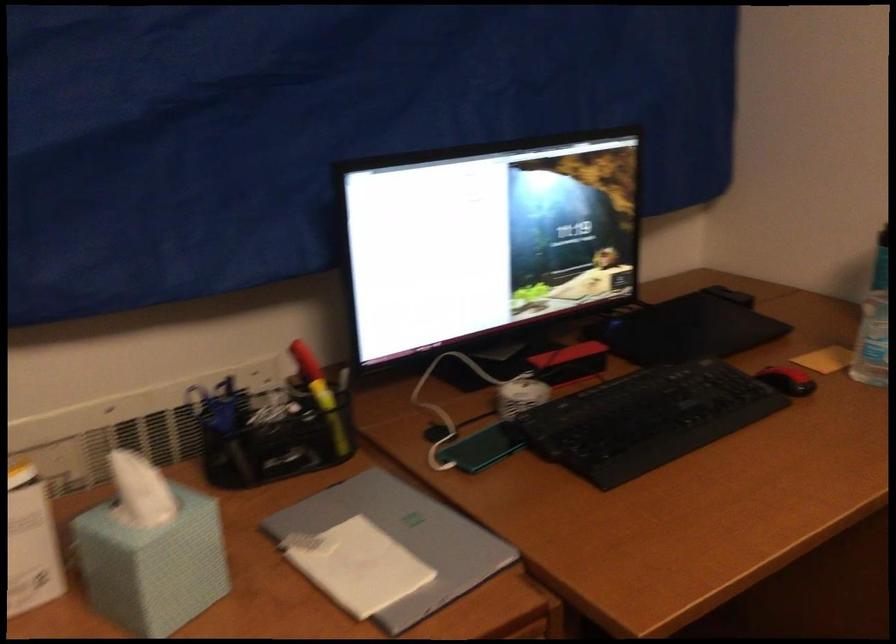
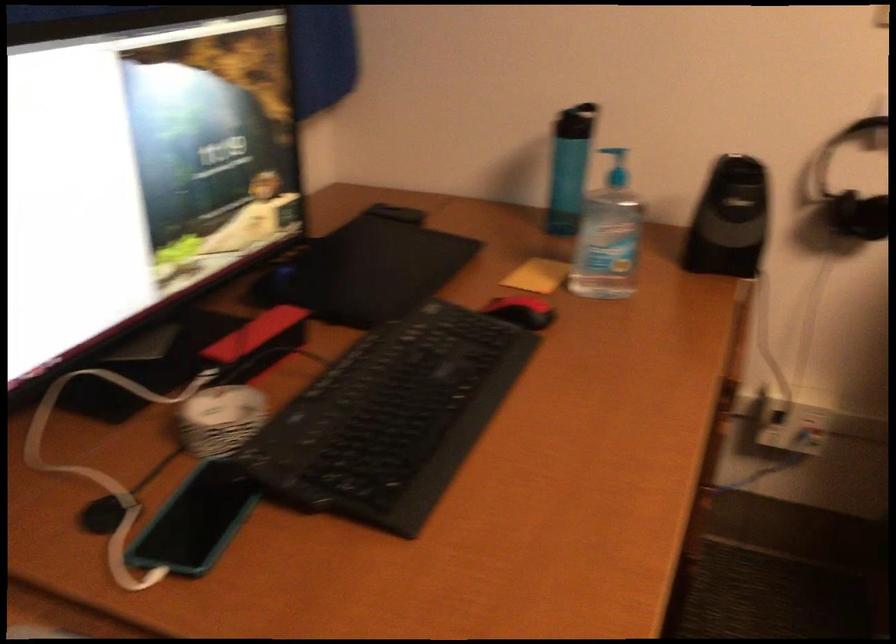
Question: The first image is from the beginning of the video and the second image is from the end. How did the camera likely rotate when shooting the video?

Choices:
 (A) Left
 (B) Right
 (C) Up
 (D) Down

Answer: (B)